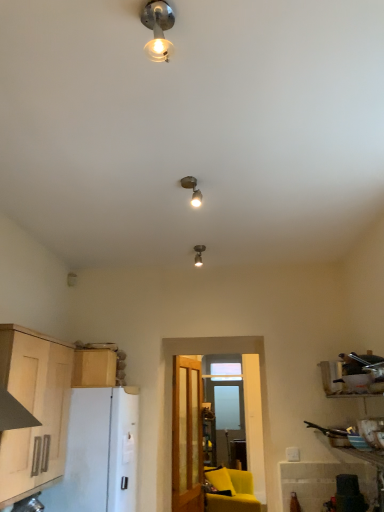
Question: From their relative heights in the image, would you say matte silver spotlight at center, placed as the 1th lamp when sorted from back to front, is taller or shorter than light wood cabinet at left, which ranks as the first cabinetry in front-to-back order?

Choices:
 (A) short
 (B) tall

Answer: (A)

Question: In terms of width, does matte silver spotlight at center, which ranks as the 1th lamp in bottom-to-top order, look wider or thinner when compared to light wood cabinet at left, which ranks as the first cabinetry in front-to-back order?

Choices:
 (A) wide
 (B) thin

Answer: (B)

Question: Estimate the real-world distances between objects in this image. Which object is closer to the light wood cabinet at upper left, the 1th cabinetry from the back?

Choices:
 (A) white matte refrigerator at left
 (B) light wood cabinet at left, which ranks as the first cabinetry in front-to-back order
 (C) metallic bulb at upper center, arranged as the 1th lamp when viewed from the top
 (D) satin silver spotlight at center, the second lamp when ordered from front to back
 (E) matte yellow armchair at lower center

Answer: (A)

Question: Which object is the closest to the satin silver spotlight at center, the second lamp when ordered from front to back?

Choices:
 (A) metallic bulb at upper center, arranged as the 1th lamp when viewed from the top
 (B) white matte refrigerator at left
 (C) clear glass door at center
 (D) light wood cabinet at left, which ranks as the first cabinetry in front-to-back order
 (E) matte yellow armchair at lower center

Answer: (A)